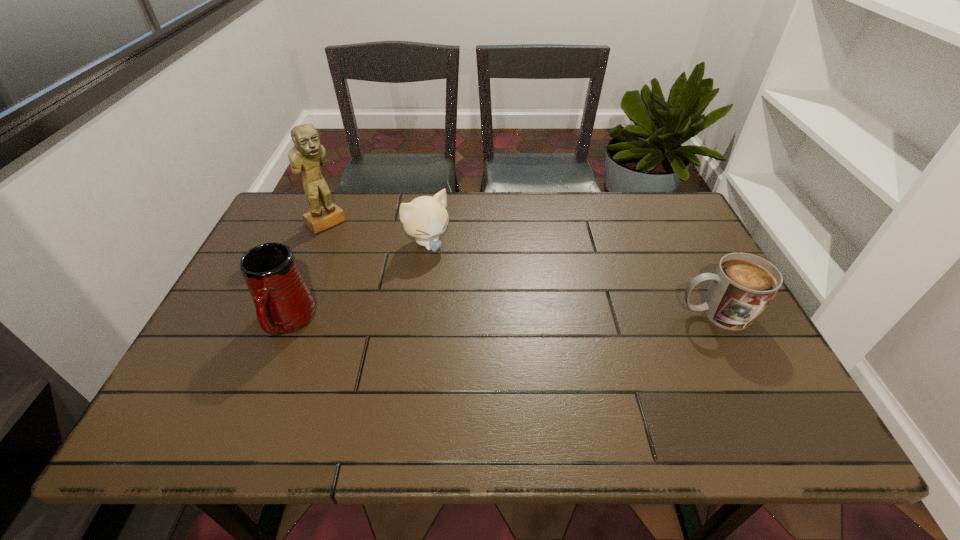
Identify the location of vacant space that satisfies the following two spatial constraints: 1. on the front side of the figurine; 2. on the side of the shorter mug with the handle. The height and width of the screenshot is (540, 960). (288, 314).